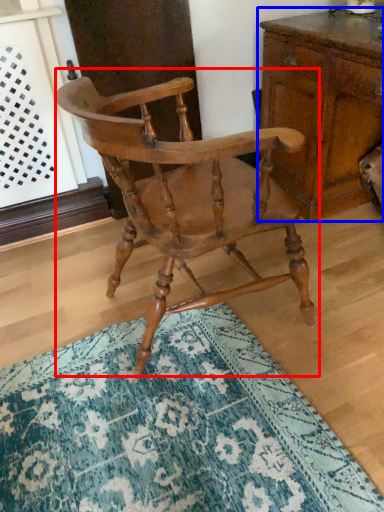
Question: Among these objects, which one is nearest to the camera, chair (highlighted by a red box) or chest of drawers (highlighted by a blue box)?

Choices:
 (A) chair
 (B) chest of drawers

Answer: (A)